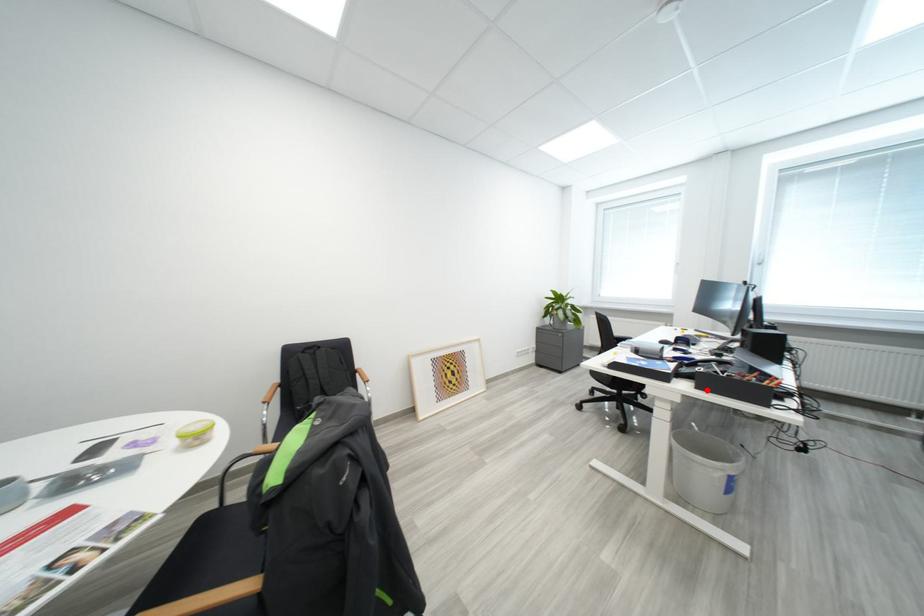
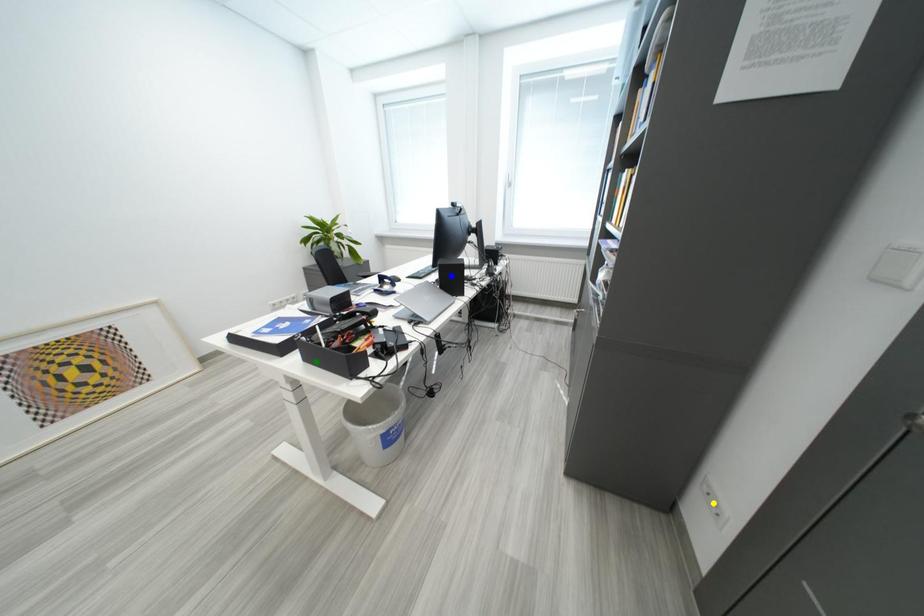
Question: I am providing you with two images of the same scene from different viewpoints. A red point is marked on the first image. You are given multiple points on the second image. Can you choose the point in image 2 that corresponds to the point in image 1?

Choices:
 (A) yellow point
 (B) green point
 (C) blue point

Answer: (B)